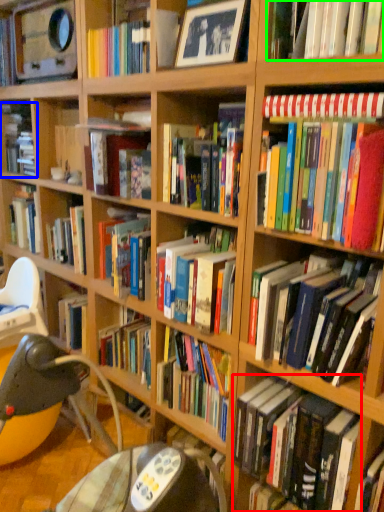
Question: Based on their relative distances, which object is nearer to book (highlighted by a red box)? Choose from book (highlighted by a blue box) and book (highlighted by a green box).

Choices:
 (A) book
 (B) book

Answer: (B)